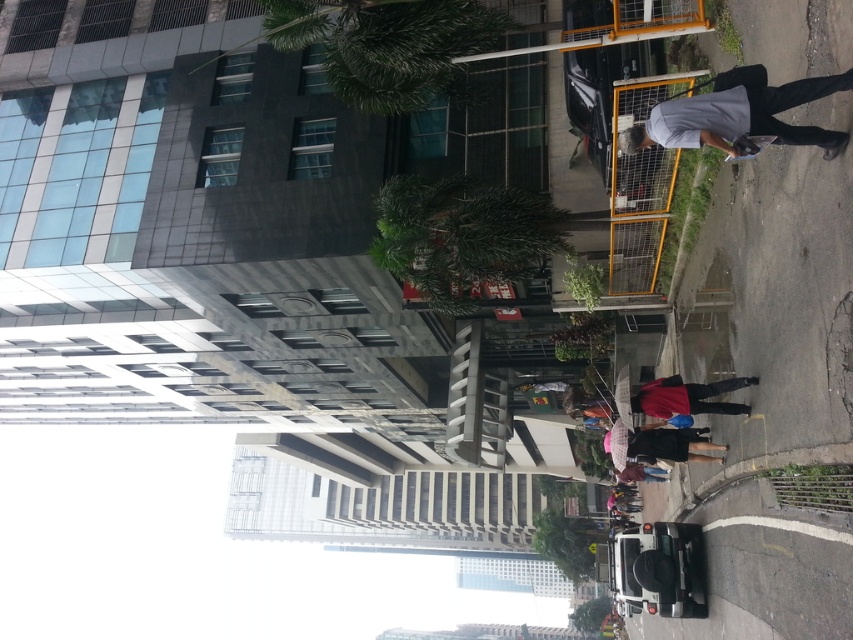
Based on the photo, can you confirm if gray matte skateboard at right is positioned above pink fabric umbrella at center?

Indeed, gray matte skateboard at right is positioned over pink fabric umbrella at center.

Does gray matte skateboard at right appear under pink fabric umbrella at center?

Actually, gray matte skateboard at right is above pink fabric umbrella at center.

Is point (769, 109) closer to camera compared to point (698, 444)?

Yes.

The height and width of the screenshot is (640, 853). In order to click on gray matte skateboard at right in this screenshot , I will do `click(738, 115)`.